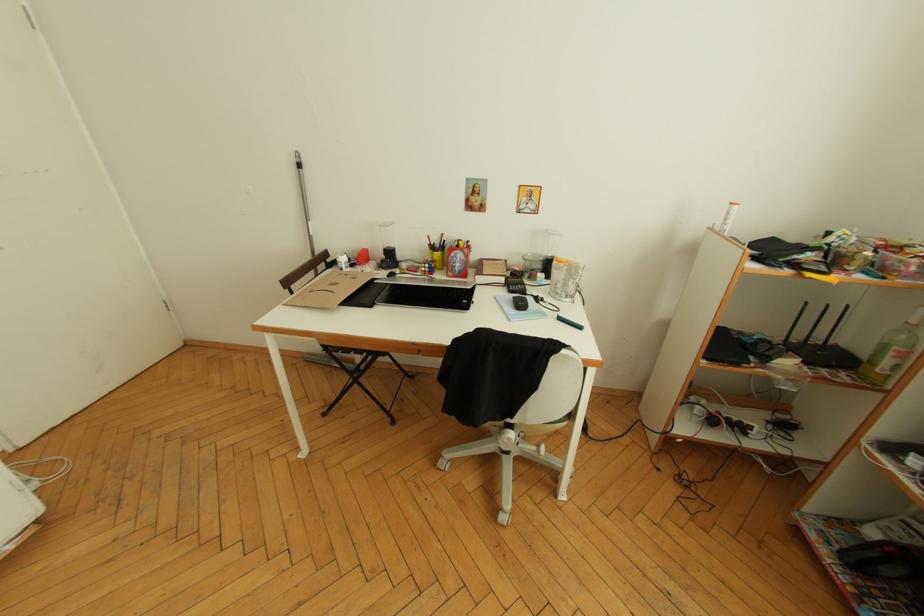
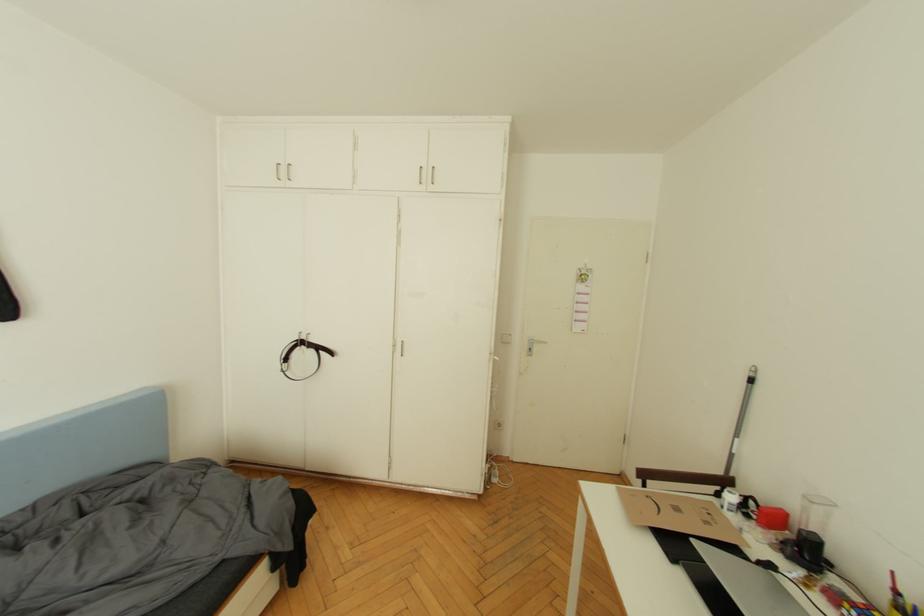
Question: Based on the continuous images, in which direction is the camera rotating? Reply with the corresponding letter.

Choices:
 (A) Left
 (B) Right
 (C) Up
 (D) Down

Answer: (A)